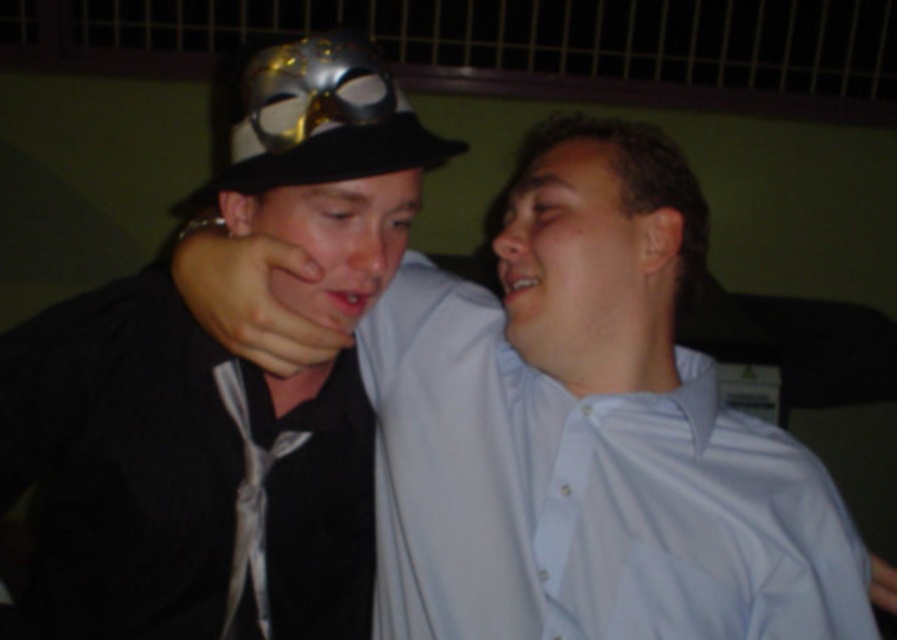
Question: Which object appears farthest from the camera in this image?

Choices:
 (A) black felt hat at upper left
 (B) smooth skin face at center

Answer: (B)

Question: Is black felt hat at upper left smaller than silky silver tie at center?

Choices:
 (A) yes
 (B) no

Answer: (B)

Question: Is matte black face at center positioned in front of silky silver tie at center?

Choices:
 (A) no
 (B) yes

Answer: (B)

Question: Considering the real-world distances, which object is farthest from the silky silver tie at center?

Choices:
 (A) smooth skin face at center
 (B) matte black face at center

Answer: (A)

Question: Can you confirm if matte black shirt at center is bigger than black felt hat at upper left?

Choices:
 (A) yes
 (B) no

Answer: (A)

Question: Which point appears farthest from the camera in this image?

Choices:
 (A) (595, 307)
 (B) (354, 262)

Answer: (B)